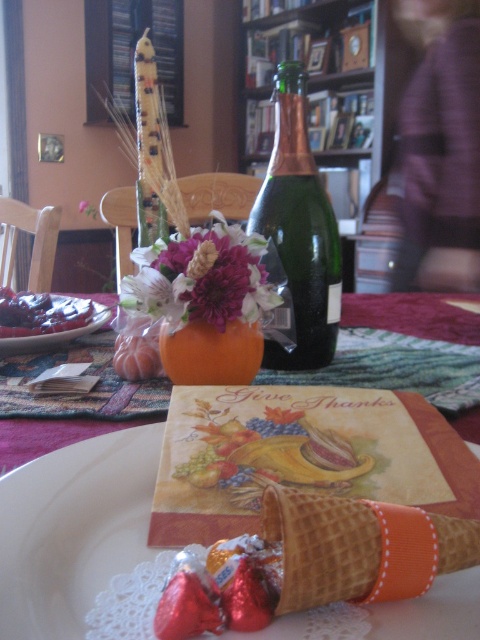
Question: Does green glass bottle at center lie in front of orange matte pumpkin at center?

Choices:
 (A) no
 (B) yes

Answer: (A)

Question: Which object is closer to the camera taking this photo?

Choices:
 (A) orange ribbon/waffle cone at lower right
 (B) matte orange vase at center

Answer: (B)

Question: Estimate the real-world distances between objects in this image. Which object is farther from the orange ribbon/waffle cone at lower right?

Choices:
 (A) green glass bottle at center
 (B) matte orange vase at center
 (C) matte plastic grapes at left

Answer: (C)

Question: Does matte orange vase at center appear under matte floral arrangement at center?

Choices:
 (A) yes
 (B) no

Answer: (A)

Question: Estimate the real-world distances between objects in this image. Which object is closer to the matte plastic grapes at left?

Choices:
 (A) matte orange vase at center
 (B) orange matte pumpkin at center
 (C) matte floral arrangement at center
 (D) green glass bottle at center

Answer: (C)

Question: Is green glass bottle at center to the left of orange ribbon/waffle cone at lower right from the viewer's perspective?

Choices:
 (A) no
 (B) yes

Answer: (B)